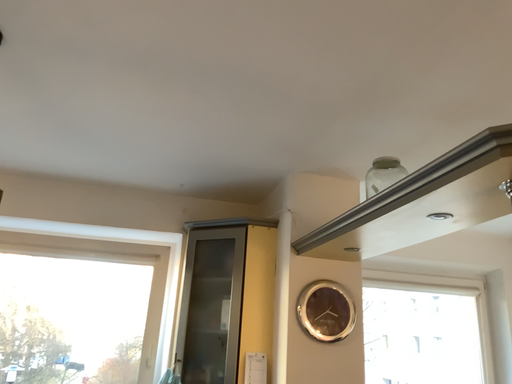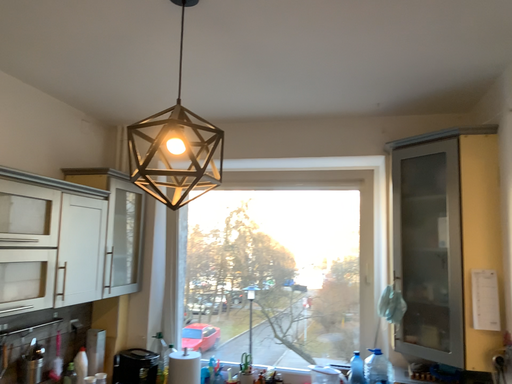
Question: How did the camera likely rotate when shooting the video?

Choices:
 (A) rotated right
 (B) rotated left

Answer: (B)